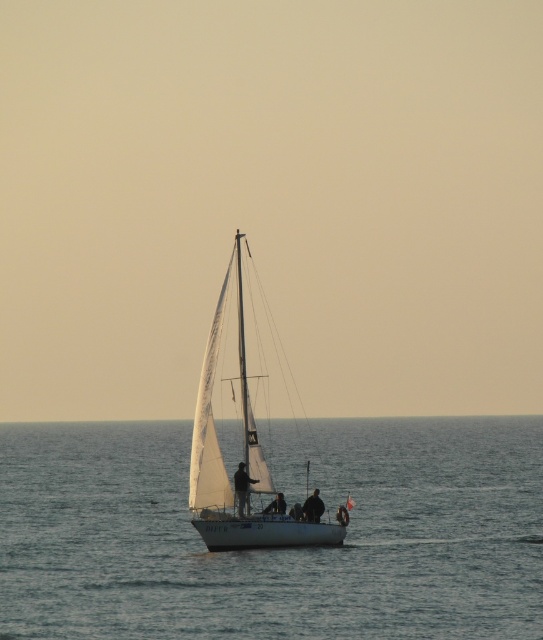
Question: Which of the following is the farthest from the observer?

Choices:
 (A) dark blue fabric jacket at center
 (B) clear blue water at center
 (C) dark fabric jacket at center

Answer: (C)

Question: Estimate the real-world distances between objects in this image. Which object is farther from the white sailboat at center?

Choices:
 (A) silhouette figure at center
 (B) dark blue fabric jacket at center
 (C) dark fabric jacket at center

Answer: (C)

Question: Which of these objects is positioned farthest from the clear blue water at center?

Choices:
 (A) dark blue fabric jacket at center
 (B) white sailboat at center

Answer: (B)

Question: In this image, where is clear blue water at center located relative to silhouette figure at center?

Choices:
 (A) below
 (B) above

Answer: (A)

Question: Does clear blue water at center lie behind silhouette figure at center?

Choices:
 (A) no
 (B) yes

Answer: (A)

Question: Can you confirm if silhouette figure at center is thinner than dark blue fabric jacket at center?

Choices:
 (A) no
 (B) yes

Answer: (B)